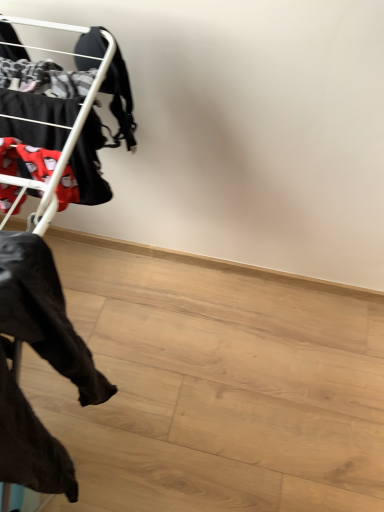
What is the approximate height of black fabric pants at left?

black fabric pants at left is 66.22 centimeters in height.

This screenshot has width=384, height=512. Identify the location of black fabric pants at left. (48, 323).

What do you see at coordinates (48, 323) in the screenshot? The width and height of the screenshot is (384, 512). I see `black fabric pants at left` at bounding box center [48, 323].

This screenshot has height=512, width=384. What do you see at coordinates (69, 109) in the screenshot? I see `matte black clothing rack at left` at bounding box center [69, 109].

You are a GUI agent. You are given a task and a screenshot of the screen. Output one action in this format:
    pyautogui.click(x=<x>, y=<y>)
    Task: Click on the matte black clothing rack at left
    
    Given the screenshot: What is the action you would take?
    pyautogui.click(x=69, y=109)

Find the location of `black fabric pants at left`. black fabric pants at left is located at coordinates (48, 323).

Can you confirm if black fabric pants at left is positioned to the right of matte black clothing rack at left?

Indeed, black fabric pants at left is positioned on the right side of matte black clothing rack at left.

Which object is further away from the camera, black fabric pants at left or matte black clothing rack at left?

matte black clothing rack at left is further away from the camera.

Which point is more forward, (4, 274) or (58, 132)?

The point (4, 274) is more forward.

From the image's perspective, is black fabric pants at left located above or below matte black clothing rack at left?

black fabric pants at left is below matte black clothing rack at left.

From a real-world perspective, which is physically above, black fabric pants at left or matte black clothing rack at left?

In real-world perspective, matte black clothing rack at left is above.

Considering the sizes of objects black fabric pants at left and matte black clothing rack at left in the image provided, who is thinner, black fabric pants at left or matte black clothing rack at left?

black fabric pants at left.

Between black fabric pants at left and matte black clothing rack at left, which one has less height?

With less height is matte black clothing rack at left.

In the scene shown: Between black fabric pants at left and matte black clothing rack at left, which one has smaller size?

With smaller size is matte black clothing rack at left.

Is black fabric pants at left inside or outside of matte black clothing rack at left?

black fabric pants at left is not enclosed by matte black clothing rack at left.

Is black fabric pants at left far from matte black clothing rack at left?

black fabric pants at left is near matte black clothing rack at left, not far away.

Is black fabric pants at left positioned with its back to matte black clothing rack at left?

No, black fabric pants at left is not facing the opposite direction of matte black clothing rack at left.

Measure the distance between black fabric pants at left and matte black clothing rack at left.

They are 5.33 inches apart.

This screenshot has height=512, width=384. I want to click on furniture in front of the matte black clothing rack at left, so click(x=48, y=323).

Is matte black clothing rack at left at the left side of black fabric pants at left?

Indeed, matte black clothing rack at left is positioned on the left side of black fabric pants at left.

Considering the relative positions of matte black clothing rack at left and black fabric pants at left in the image provided, is matte black clothing rack at left behind black fabric pants at left?

Yes, matte black clothing rack at left is further from the viewer.

Considering the points (20, 128) and (14, 453), which point is behind, point (20, 128) or point (14, 453)?

The point (20, 128) is more distant.

From the image's perspective, is matte black clothing rack at left above or below black fabric pants at left?

From the image's perspective, matte black clothing rack at left appears above black fabric pants at left.

From a real-world perspective, which object rests below the other?

black fabric pants at left is physically lower.

In terms of width, does matte black clothing rack at left look wider or thinner when compared to black fabric pants at left?

matte black clothing rack at left is wider than black fabric pants at left.

From their relative heights in the image, would you say matte black clothing rack at left is taller or shorter than black fabric pants at left?

matte black clothing rack at left is shorter than black fabric pants at left.

Does matte black clothing rack at left have a smaller size compared to black fabric pants at left?

Yes, matte black clothing rack at left is smaller than black fabric pants at left.

Is matte black clothing rack at left outside of black fabric pants at left?

Yes.

Is matte black clothing rack at left touching black fabric pants at left?

No, matte black clothing rack at left is not beside black fabric pants at left.

Could you tell me if matte black clothing rack at left is facing black fabric pants at left?

No.

How many degrees apart are the facing directions of matte black clothing rack at left and black fabric pants at left?

The angular difference between matte black clothing rack at left and black fabric pants at left is 0.00119 degrees.

Image resolution: width=384 pixels, height=512 pixels. I want to click on bunk bed behind the black fabric pants at left, so click(69, 109).

The width and height of the screenshot is (384, 512). I want to click on bunk bed on the left of the black fabric pants at left, so click(69, 109).

Locate an element on the screen. furniture below the matte black clothing rack at left (from a real-world perspective) is located at coordinates (48, 323).